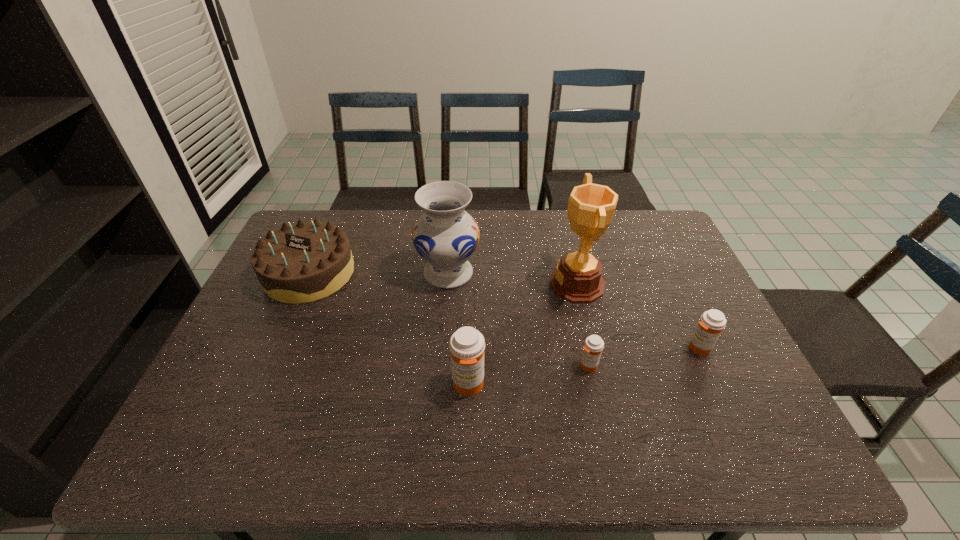
Find the location of a particular element. The image size is (960, 540). vacant space that satisfies the following two spatial constraints: 1. on the back side of the second shortest medicine; 2. on the left side of the fourth shortest object is located at coordinates (469, 348).

Where is `free space that satisfies the following two spatial constraints: 1. on the front-facing side of the leftmost object; 2. on the left side of the rightmost object`? free space that satisfies the following two spatial constraints: 1. on the front-facing side of the leftmost object; 2. on the left side of the rightmost object is located at coordinates (276, 348).

Identify the location of free space that satisfies the following two spatial constraints: 1. on the front-facing side of the award; 2. on the front side of the shortest medicine. The height and width of the screenshot is (540, 960). (596, 366).

You are a GUI agent. You are given a task and a screenshot of the screen. Output one action in this format:
    pyautogui.click(x=<x>, y=<y>)
    Task: Click on the vacant point that satisfies the following two spatial constraints: 1. on the back side of the second tallest medicine; 2. on the left side of the leftmost medicine
    
    Given the screenshot: What is the action you would take?
    pyautogui.click(x=469, y=348)